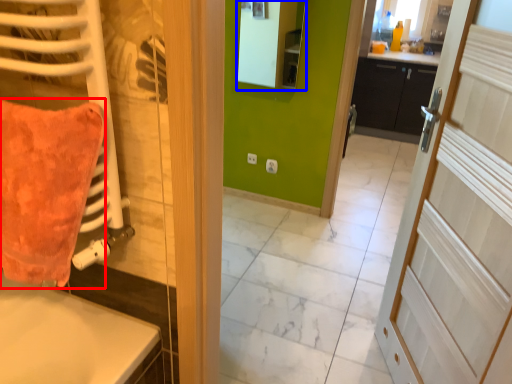
Question: Which of the following is the farthest to the observer, throw pillow (highlighted by a red box) or mirror (highlighted by a blue box)?

Choices:
 (A) throw pillow
 (B) mirror

Answer: (B)